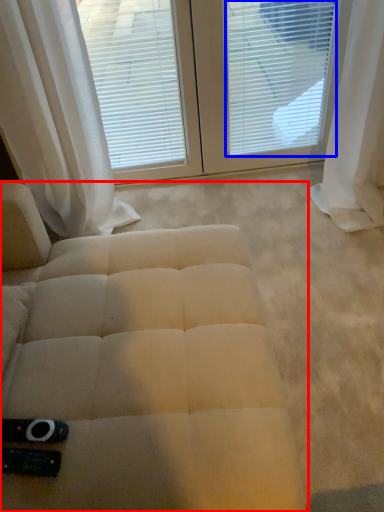
Question: Which point is closer to the camera, furniture (highlighted by a red box) or blind (highlighted by a blue box)?

Choices:
 (A) furniture
 (B) blind

Answer: (A)